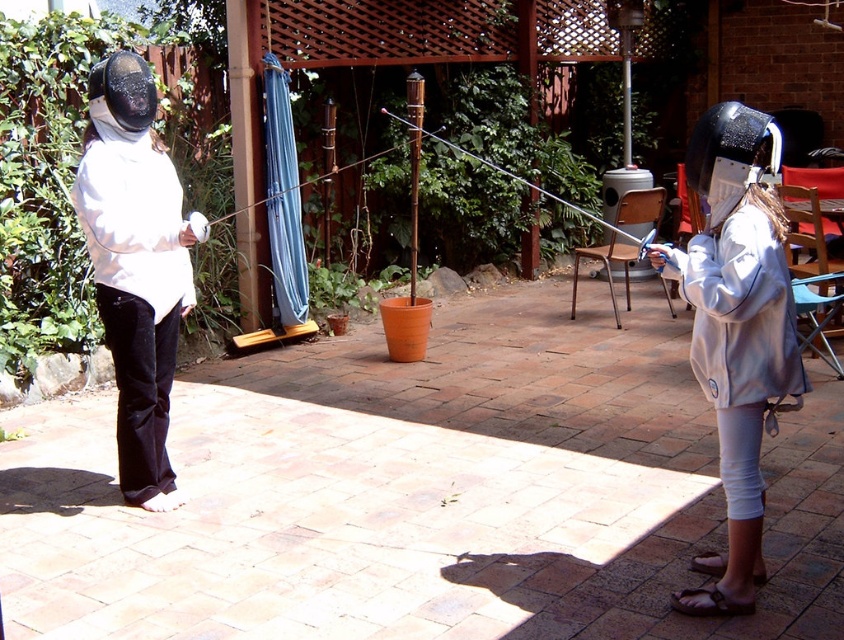
Question: Estimate the real-world distances between objects in this image. Which object is farther from the white matte jacket at left?

Choices:
 (A) white matte fencing suit at right
 (B) light gray fleece jacket at right

Answer: (A)

Question: Is white matte fencing suit at right above light gray fleece jacket at right?

Choices:
 (A) no
 (B) yes

Answer: (A)

Question: Which of the following is the farthest from the observer?

Choices:
 (A) (693, 371)
 (B) (782, 273)

Answer: (A)

Question: Does white matte fencing suit at right appear on the right side of light gray fleece jacket at right?

Choices:
 (A) yes
 (B) no

Answer: (A)

Question: Among these objects, which one is nearest to the camera?

Choices:
 (A) white matte jacket at left
 (B) white matte fencing suit at right

Answer: (B)

Question: Does white matte fencing suit at right have a greater width compared to white matte jacket at left?

Choices:
 (A) no
 (B) yes

Answer: (A)